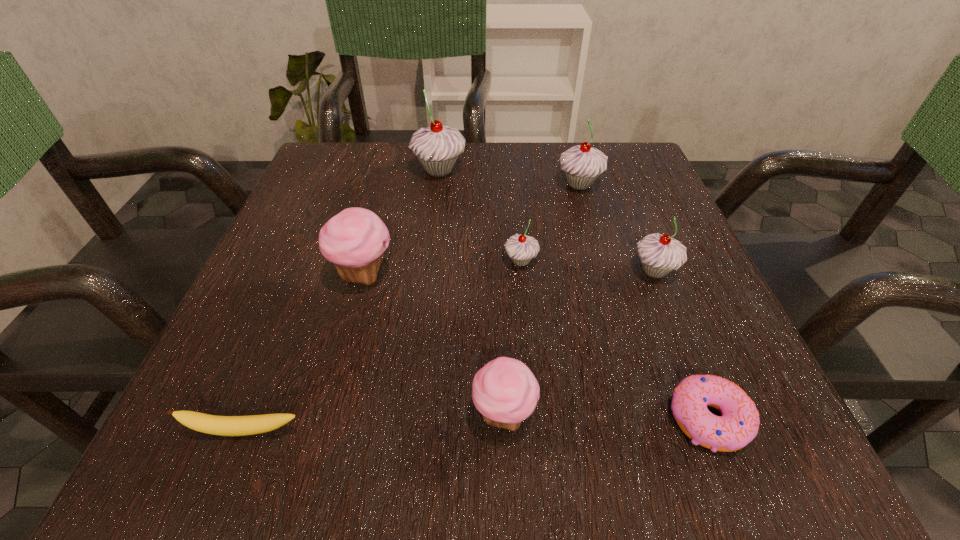
Where is `blank space at the left edge of the desktop`? The image size is (960, 540). blank space at the left edge of the desktop is located at coordinates (280, 245).

The width and height of the screenshot is (960, 540). In the image, there is a desktop. What are the coordinates of `free space at the right edge` in the screenshot? It's located at (695, 334).

The image size is (960, 540). In the image, there is a desktop. Identify the location of vacant region at the far left corner. (335, 145).

Identify the location of vacant region at the far right corner of the desktop. This screenshot has width=960, height=540. (616, 172).

In order to click on free spot between the banana and the second cupcake from right to left in this screenshot , I will do [x=412, y=307].

Locate an element on the screen. Image resolution: width=960 pixels, height=540 pixels. vacant area that lies between the pink doughnut and the fifth shortest cupcake is located at coordinates (643, 301).

Where is `vacant area that lies between the pink doughnut and the smallest gray cupcake`? vacant area that lies between the pink doughnut and the smallest gray cupcake is located at coordinates (614, 340).

Find the location of `vacant area between the yellow banana and the leftmost gray cupcake`. vacant area between the yellow banana and the leftmost gray cupcake is located at coordinates (342, 300).

Find the location of `blank region between the left pink cupcake and the third smallest gray cupcake`. blank region between the left pink cupcake and the third smallest gray cupcake is located at coordinates (471, 229).

Locate an element on the screen. free space between the third smallest gray cupcake and the nearest cupcake is located at coordinates (541, 299).